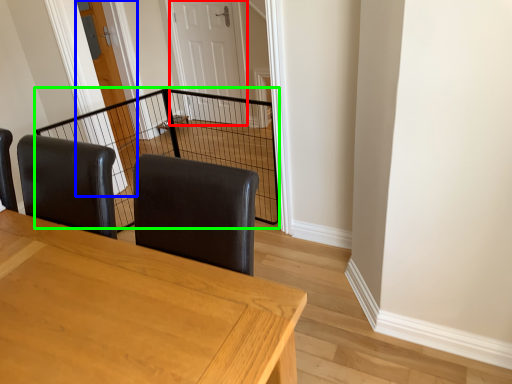
Question: Which is farther away from door (highlighted by a red box)? door (highlighted by a blue box) or cage (highlighted by a green box)?

Choices:
 (A) door
 (B) cage

Answer: (A)